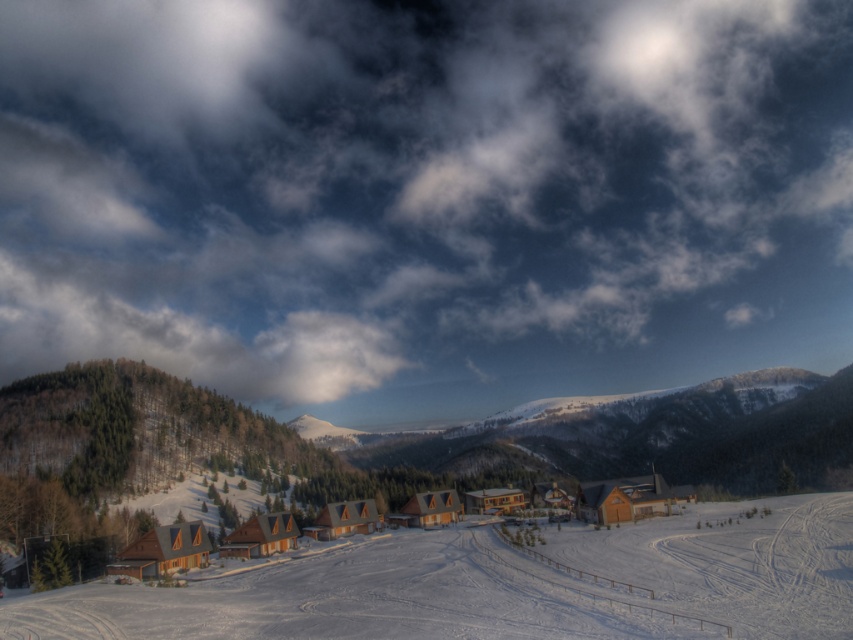
Question: Can you confirm if cloudy sky at upper center is positioned to the right of wooden cabin at center?

Choices:
 (A) no
 (B) yes

Answer: (A)

Question: Which of the following is the farthest from the observer?

Choices:
 (A) (248, 305)
 (B) (314, 520)
 (C) (547, 602)

Answer: (A)

Question: Which object is farther from the camera taking this photo?

Choices:
 (A) smooth snow ski slope at center
 (B) wooden cabin at center

Answer: (B)

Question: Which point is closer to the camera?

Choices:
 (A) cloudy sky at upper center
 (B) wooden cabin at center

Answer: (B)

Question: In this image, where is cloudy sky at upper center located relative to wooden cabin at center?

Choices:
 (A) left
 (B) right

Answer: (A)

Question: Can you confirm if smooth snow ski slope at center is positioned below wooden cabin at center?

Choices:
 (A) yes
 (B) no

Answer: (B)